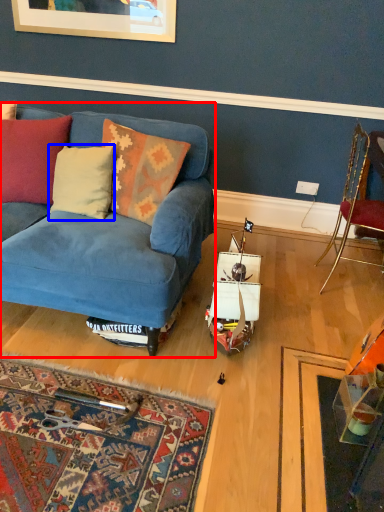
Question: Among these objects, which one is farthest to the camera, studio couch (highlighted by a red box) or pillow (highlighted by a blue box)?

Choices:
 (A) studio couch
 (B) pillow

Answer: (B)